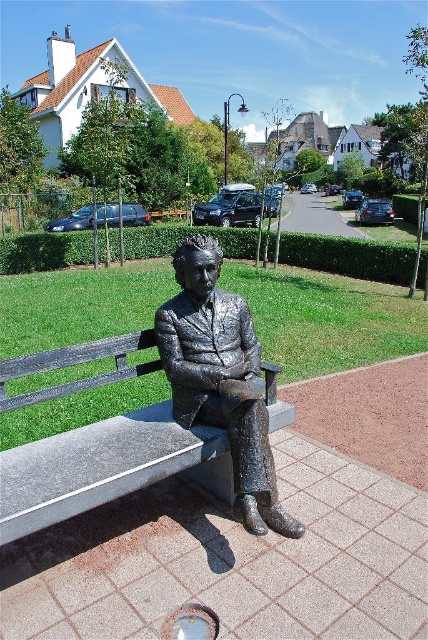
Between smooth gray bench at center and shiny bronze statue at center, which one appears on the right side from the viewer's perspective?

Positioned to the right is shiny bronze statue at center.

Looking at this image, can you confirm if smooth gray bench at center is positioned to the right of shiny bronze statue at center?

No, smooth gray bench at center is not to the right of shiny bronze statue at center.

Is point (112, 352) more distant than point (240, 387)?

Yes, point (112, 352) is farther from viewer.

Image resolution: width=428 pixels, height=640 pixels. I want to click on smooth gray bench at center, so click(104, 467).